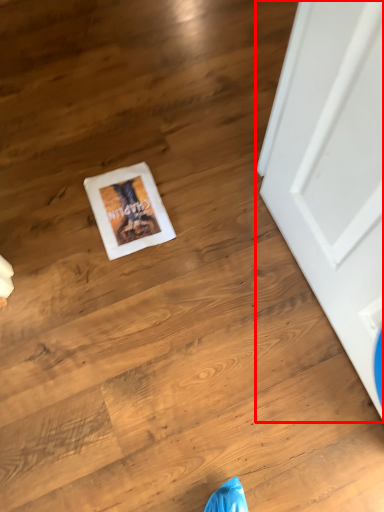
Question: From the image's perspective, considering the relative positions of door (annotated by the red box) and postcard in the image provided, where is door (annotated by the red box) located with respect to the staircase?

Choices:
 (A) above
 (B) below

Answer: (B)